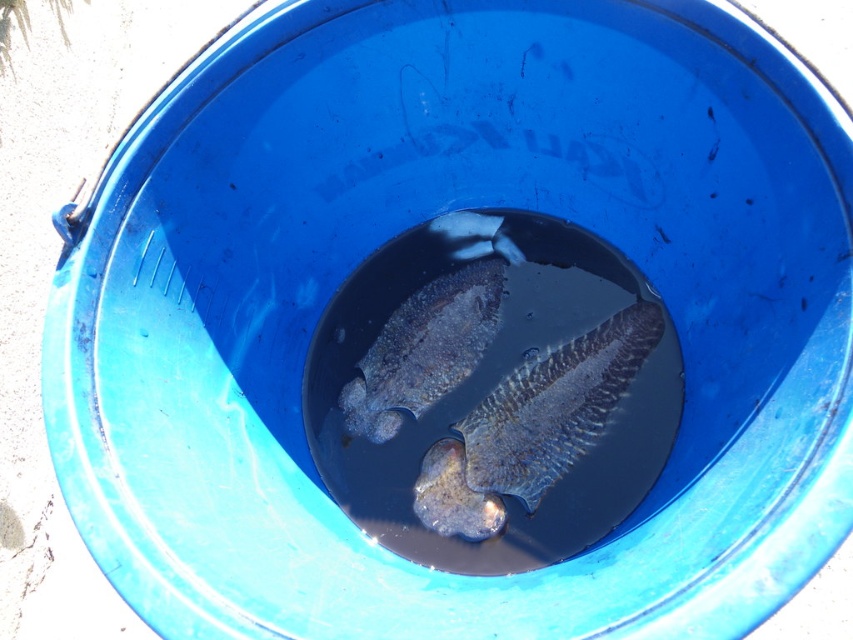
Who is higher up, dark gray textured fish at center or smooth grayish fish at center?

smooth grayish fish at center is higher up.

Is dark gray textured fish at center to the left of smooth grayish fish at center from the viewer's perspective?

In fact, dark gray textured fish at center is to the right of smooth grayish fish at center.

Where is `dark gray textured fish at center`? dark gray textured fish at center is located at coordinates (555, 406).